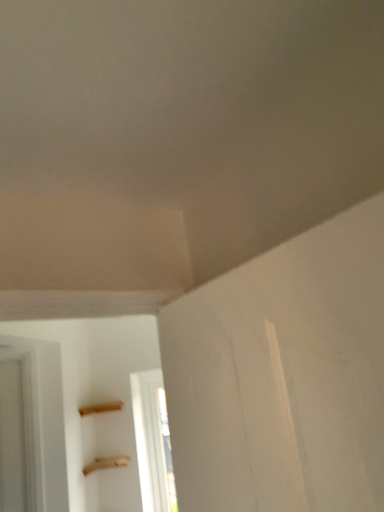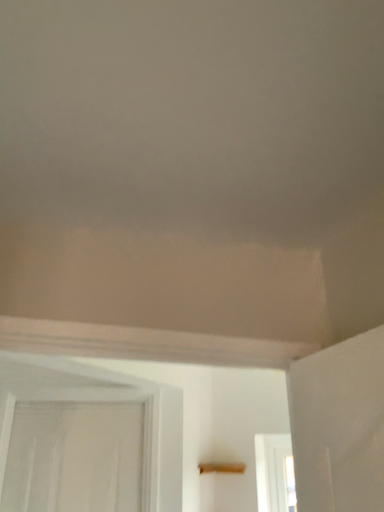
Question: How did the camera likely rotate when shooting the video?

Choices:
 (A) rotated downward
 (B) rotated upward

Answer: (B)